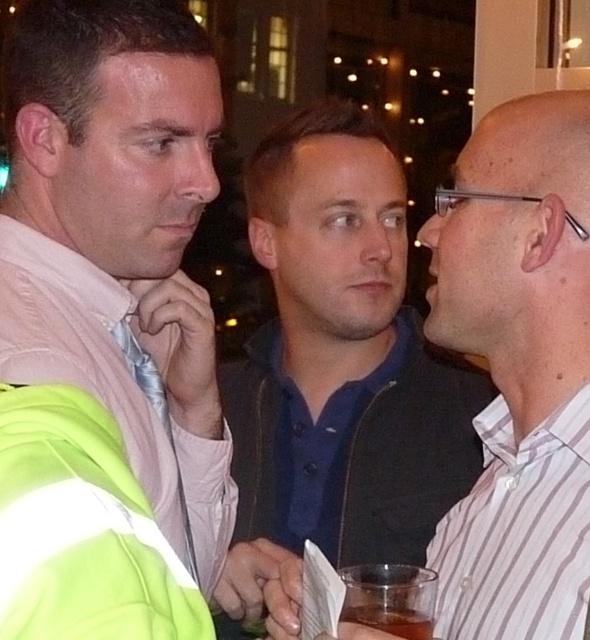
Who is positioned more to the right, pink fabric shirt at left or green reflective safety vest at lower left?

green reflective safety vest at lower left is more to the right.

Which is in front, point (155, 61) or point (100, 508)?

Point (100, 508) is in front.

Who is more forward, (60, 236) or (34, 596)?

Positioned in front is point (34, 596).

In order to click on pink fabric shirt at left in this screenshot , I will do `click(109, 326)`.

Which of these two, blue shirt at center or brown translucent glass at lower center, stands taller?

blue shirt at center

You are a GUI agent. You are given a task and a screenshot of the screen. Output one action in this format:
    pyautogui.click(x=<x>, y=<y>)
    Task: Click on the blue shirt at center
    This screenshot has width=590, height=640.
    Given the screenshot: What is the action you would take?
    pyautogui.click(x=519, y=369)

Where is `blue shirt at center`? blue shirt at center is located at coordinates (519, 369).

Does pink fabric shirt at left appear over brown translucent glass at lower center?

Yes.

Is pink fabric shirt at left thinner than brown translucent glass at lower center?

Incorrect, pink fabric shirt at left's width is not less than brown translucent glass at lower center's.

Describe the element at coordinates (109, 326) in the screenshot. I see `pink fabric shirt at left` at that location.

In order to click on pink fabric shirt at left in this screenshot , I will do `click(109, 326)`.